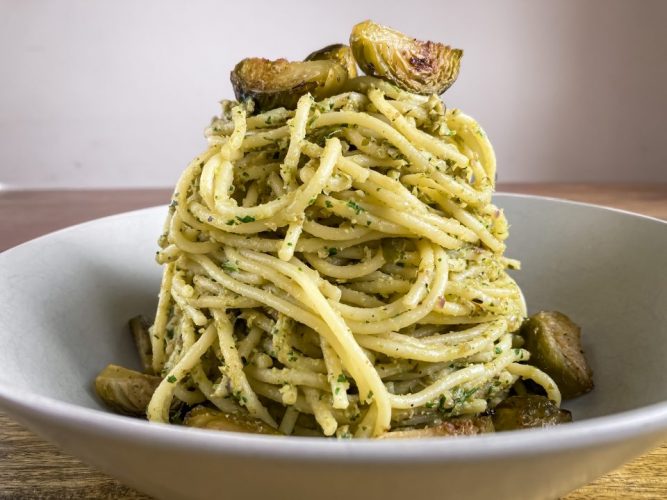
What are the coordinates of `top edge of bowl` in the screenshot? It's located at (11, 247), (95, 217), (533, 195), (638, 213).